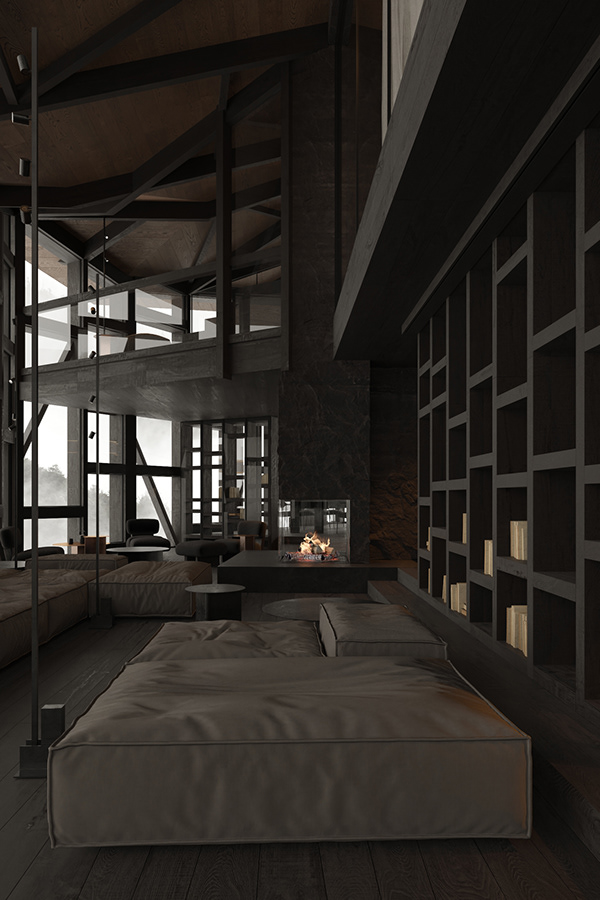
Where is `large square cushions`? large square cushions is located at coordinates (299, 720), (367, 626), (231, 644), (167, 580), (90, 562), (56, 591).